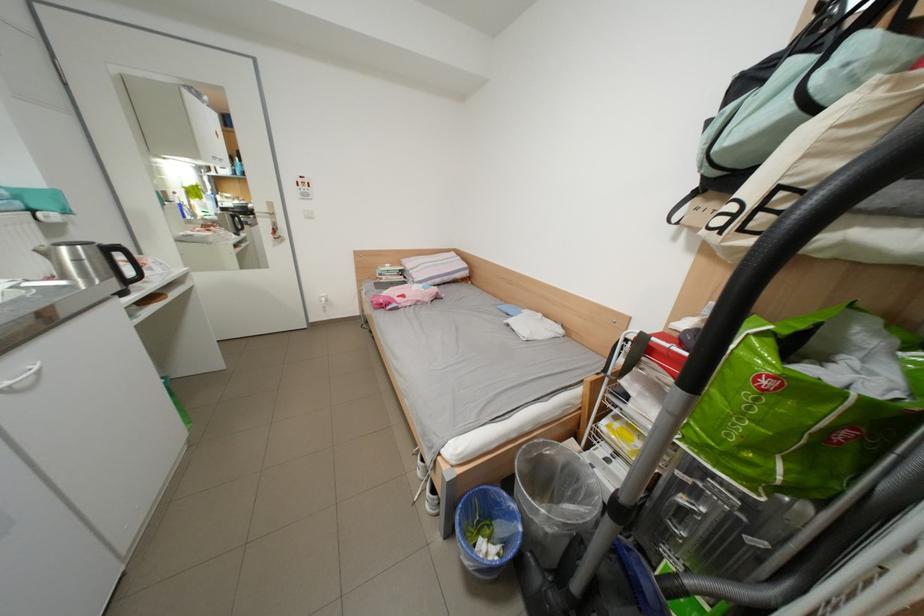
This screenshot has width=924, height=616. What do you see at coordinates (825, 180) in the screenshot?
I see `a beige tote bag` at bounding box center [825, 180].